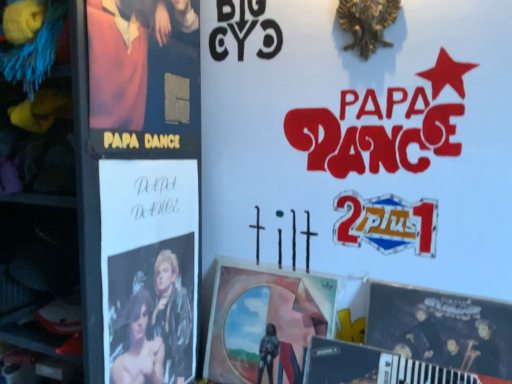
Question: From the image's perspective, is metallic silver magazine at lower right beneath matte black poster at lower right, which is the third poster from left to right?

Choices:
 (A) yes
 (B) no

Answer: (A)

Question: Considering the relative sizes of metallic silver magazine at lower right and matte black poster at lower right, which is the third poster from left to right, in the image provided, is metallic silver magazine at lower right bigger than matte black poster at lower right, which is the third poster from left to right,?

Choices:
 (A) yes
 (B) no

Answer: (A)

Question: Is metallic silver magazine at lower right further to the viewer compared to matte black poster at lower right, which is the third poster from left to right?

Choices:
 (A) yes
 (B) no

Answer: (B)

Question: From a real-world perspective, is metallic silver magazine at lower right physically above matte black poster at lower right, which ranks as the first poster in right-to-left order?

Choices:
 (A) no
 (B) yes

Answer: (A)

Question: Is metallic silver magazine at lower right with matte black poster at lower right, which is the third poster from left to right?

Choices:
 (A) yes
 (B) no

Answer: (A)

Question: Is black glossy poster at left, arranged as the third poster when viewed from the right, in front of or behind metallic silver magazine at lower right in the image?

Choices:
 (A) front
 (B) behind

Answer: (B)

Question: Do you think black glossy poster at left, placed as the 1th poster when sorted from left to right, is within metallic silver magazine at lower right, or outside of it?

Choices:
 (A) outside
 (B) inside

Answer: (A)

Question: Is black glossy poster at left, placed as the 1th poster when sorted from left to right, to the left or to the right of metallic silver magazine at lower right in the image?

Choices:
 (A) left
 (B) right

Answer: (A)

Question: In terms of width, does black glossy poster at left, arranged as the third poster when viewed from the right, look wider or thinner when compared to metallic silver magazine at lower right?

Choices:
 (A) thin
 (B) wide

Answer: (A)

Question: From their relative heights in the image, would you say black glossy poster at left, placed as the 1th poster when sorted from left to right, is taller or shorter than matte black poster at lower right, which is the third poster from left to right?

Choices:
 (A) short
 (B) tall

Answer: (B)

Question: From a real-world perspective, relative to matte black poster at lower right, which is the third poster from left to right, is black glossy poster at left, arranged as the third poster when viewed from the right, vertically above or below?

Choices:
 (A) below
 (B) above

Answer: (B)

Question: Relative to matte black poster at lower right, which ranks as the first poster in right-to-left order, is black glossy poster at left, arranged as the third poster when viewed from the right, in front or behind?

Choices:
 (A) behind
 (B) front

Answer: (A)

Question: Considering the positions of black glossy poster at left, arranged as the third poster when viewed from the right, and matte black poster at lower right, which is the third poster from left to right, in the image, is black glossy poster at left, arranged as the third poster when viewed from the right, bigger or smaller than matte black poster at lower right, which is the third poster from left to right,?

Choices:
 (A) big
 (B) small

Answer: (B)

Question: Is matte pink fabric at left taller or shorter than matte black poster at lower right, which is the third poster from left to right?

Choices:
 (A) tall
 (B) short

Answer: (A)

Question: In terms of width, does matte pink fabric at left look wider or thinner when compared to matte black poster at lower right, which is the third poster from left to right?

Choices:
 (A) thin
 (B) wide

Answer: (A)